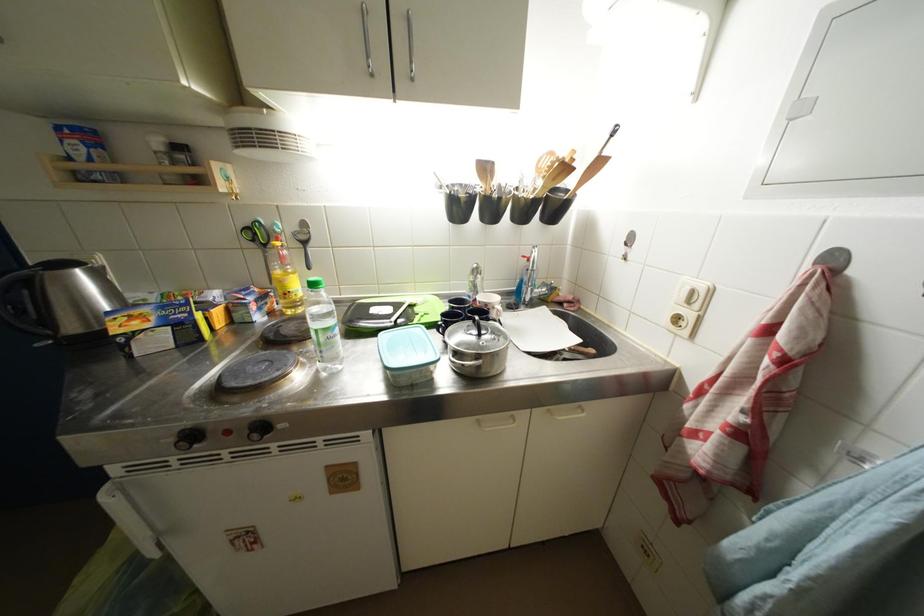
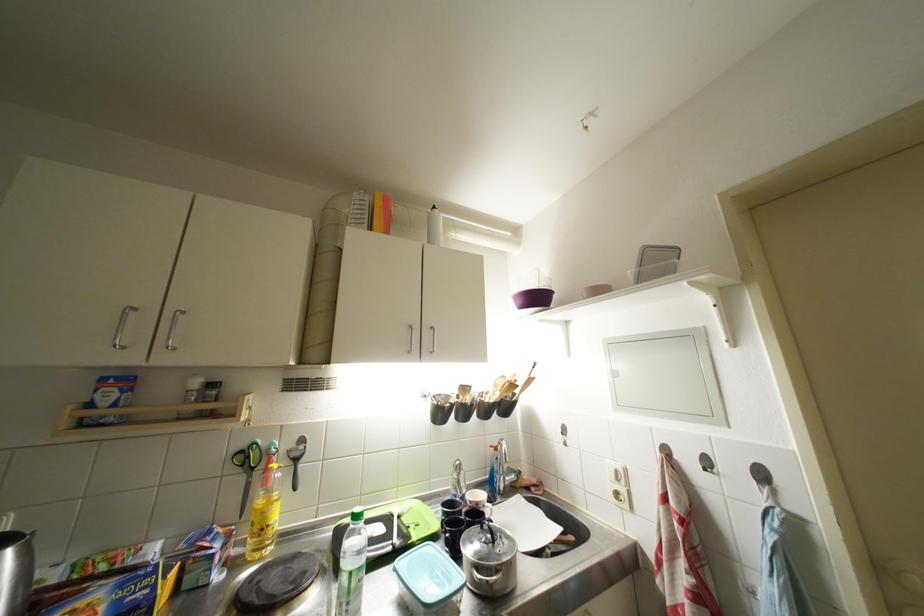
The point at (x=304, y=233) is marked in the first image. Where is the corresponding point in the second image?

(299, 450)